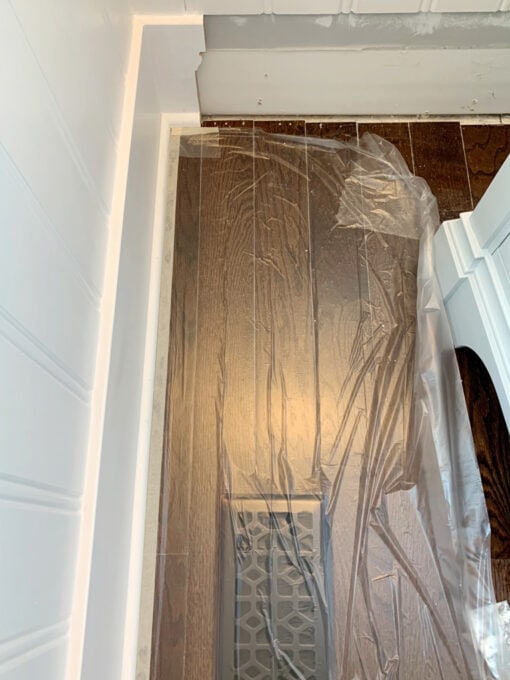
The image size is (510, 680). What are the coordinates of `metal grate vent covering` in the screenshot? It's located at (223, 621).